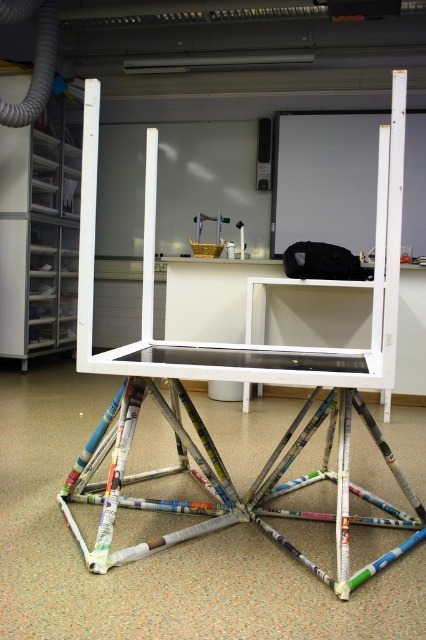
Question: Which point appears farthest from the camera in this image?

Choices:
 (A) (362, 356)
 (B) (362, 308)
 (C) (210, 515)
 (D) (3, 150)

Answer: (D)

Question: Can you confirm if white painted wood table at center is positioned below white matte ladder at center?

Choices:
 (A) no
 (B) yes

Answer: (B)

Question: Which object appears closest to the camera in this image?

Choices:
 (A) white matte easel at upper left
 (B) white matte ladder at center
 (C) white glossy table at center

Answer: (B)

Question: Is white matte easel at upper left further to the viewer compared to white glossy table at center?

Choices:
 (A) no
 (B) yes

Answer: (B)

Question: Can you confirm if white painted wood table at center is bigger than white matte easel at upper left?

Choices:
 (A) yes
 (B) no

Answer: (B)

Question: Which of the following is the closest to the observer?

Choices:
 (A) (420, 502)
 (B) (203, 304)
 (C) (52, 179)

Answer: (A)